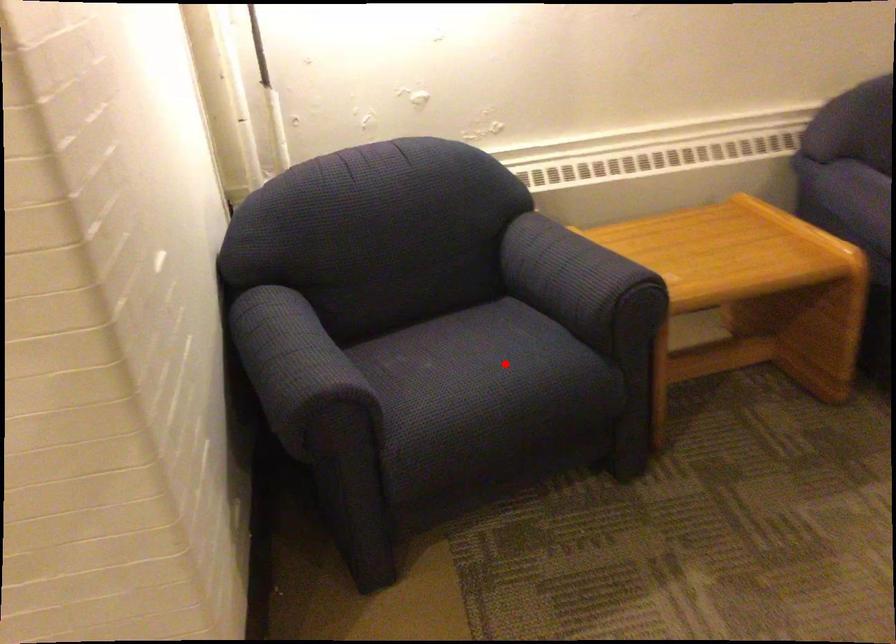
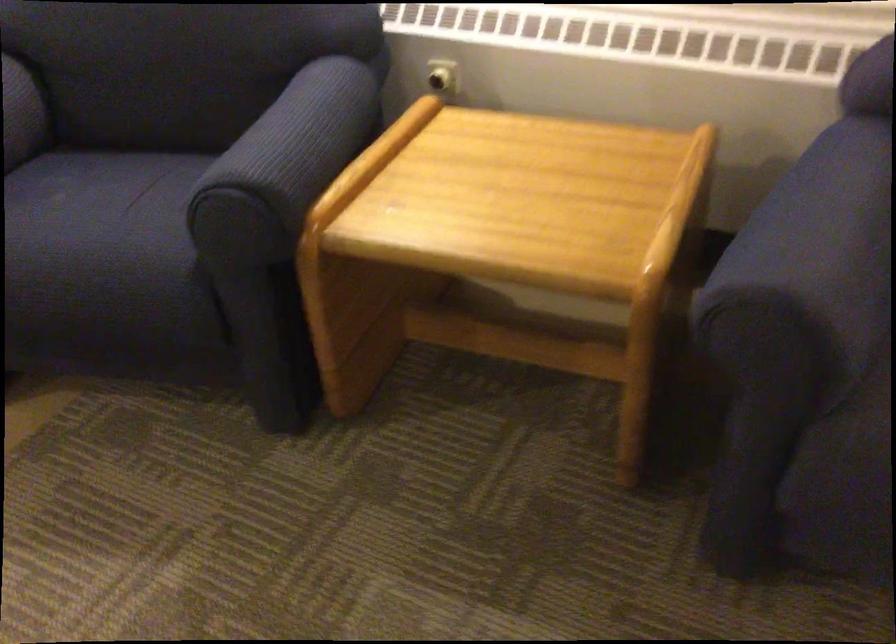
Question: I am providing you with two images of the same scene from different viewpoints. Given a red point in image1, look at the same physical point in image2. Is it:

Choices:
 (A) Closer to the viewpoint
 (B) Farther from the viewpoint

Answer: (A)